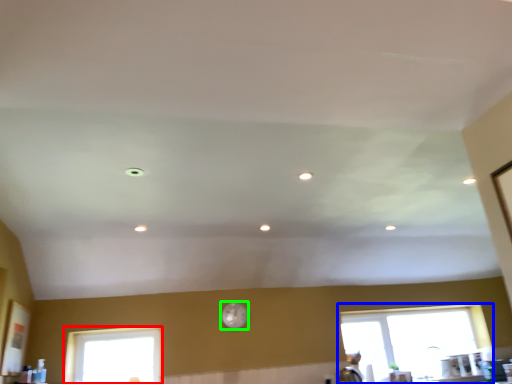
Question: Based on their relative distances, which object is nearer to window (highlighted by a red box)? Choose from window (highlighted by a blue box) and clock (highlighted by a green box).

Choices:
 (A) window
 (B) clock

Answer: (B)